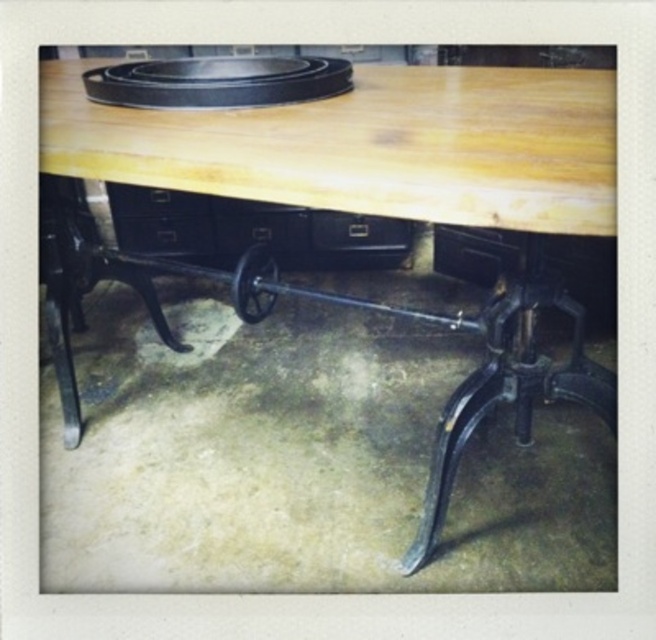
Question: Is natural wood table at center positioned at the back of black matte drawer at center?

Choices:
 (A) yes
 (B) no

Answer: (B)

Question: Is natural wood table at center positioned before black matte drawer at center?

Choices:
 (A) no
 (B) yes

Answer: (B)

Question: Which point is closer to the camera?

Choices:
 (A) (371, 92)
 (B) (209, 240)

Answer: (A)

Question: Which object is closer to the camera taking this photo?

Choices:
 (A) natural wood table at center
 (B) black matte drawer at center

Answer: (A)

Question: Is natural wood table at center thinner than black matte drawer at center?

Choices:
 (A) yes
 (B) no

Answer: (B)